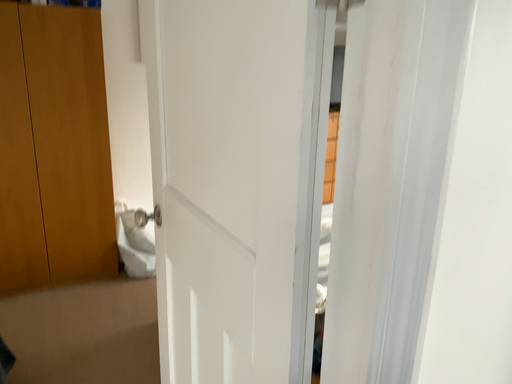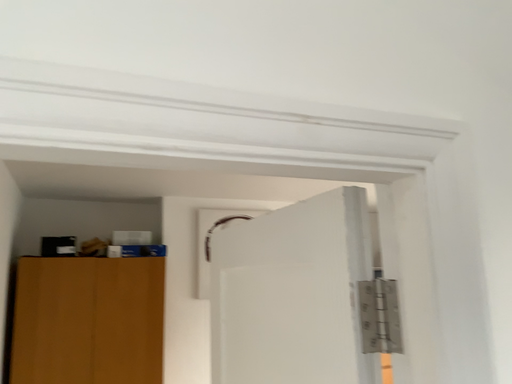
Question: Which way did the camera rotate in the video?

Choices:
 (A) rotated upward
 (B) rotated downward

Answer: (A)